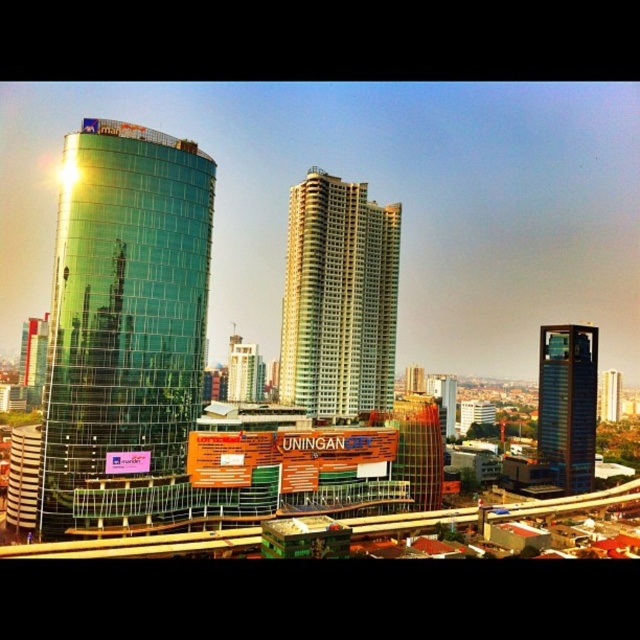
Is point (192, 314) positioned behind point (378, 228)?

That is False.

Is point (113, 324) behind point (324, 186)?

That is False.

This screenshot has width=640, height=640. I want to click on green glass tower at left, so click(x=124, y=310).

Is glassy blue skyscraper at right closer to camera compared to glassy blue skyscraper at center?

Yes.

Who is more forward, [547,385] or [602,406]?

Point [547,385] is more forward.

Identify the location of glassy blue skyscraper at right. The width and height of the screenshot is (640, 640). (566, 403).

Is green glass tower at left to the right of glassy blue skyscraper at center from the viewer's perspective?

No, green glass tower at left is not to the right of glassy blue skyscraper at center.

Does green glass tower at left have a smaller size compared to glassy blue skyscraper at center?

No.

Is point (166, 166) behind point (614, 378)?

No, (166, 166) is closer to viewer.

Image resolution: width=640 pixels, height=640 pixels. I want to click on green glass tower at left, so click(124, 310).